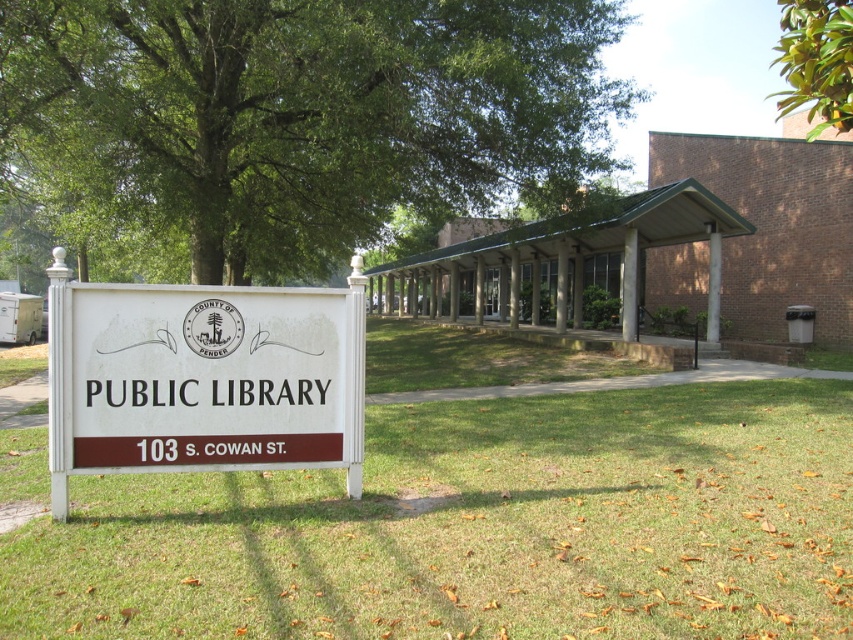
Question: Is green grass at lower center bigger than green leafy tree at upper left?

Choices:
 (A) no
 (B) yes

Answer: (A)

Question: Considering the real-world distances, which object is closest to the green grass at lower center?

Choices:
 (A) green leafy tree at upper left
 (B) green leafy tree at upper right
 (C) white plastic sign at center

Answer: (C)

Question: Does white plastic sign at center appear on the left side of green leafy tree at upper right?

Choices:
 (A) yes
 (B) no

Answer: (A)

Question: Which of the following is the closest to the observer?

Choices:
 (A) white plastic sign at center
 (B) green grass at lower center
 (C) green leafy tree at upper right
 (D) green leafy tree at upper left

Answer: (A)

Question: Is green leafy tree at upper left wider than green leafy tree at upper right?

Choices:
 (A) yes
 (B) no

Answer: (A)

Question: Estimate the real-world distances between objects in this image. Which object is farther from the green grass at lower center?

Choices:
 (A) green leafy tree at upper right
 (B) white plastic sign at center

Answer: (A)